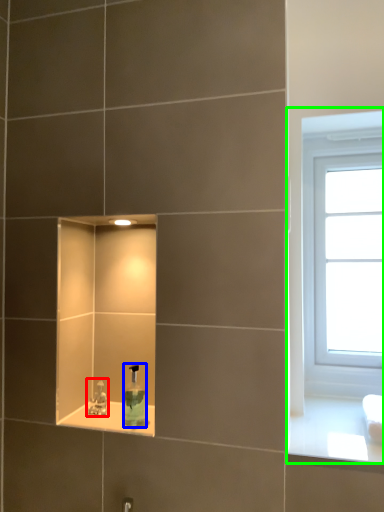
Question: Which is farther away from tap (highlighted by a red box)? soap dispenser (highlighted by a blue box) or window (highlighted by a green box)?

Choices:
 (A) soap dispenser
 (B) window

Answer: (B)